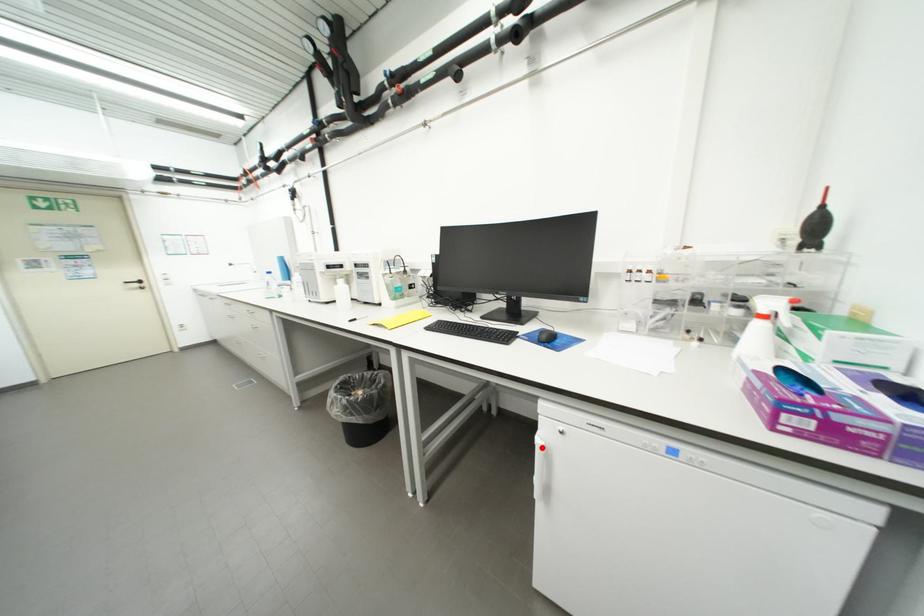
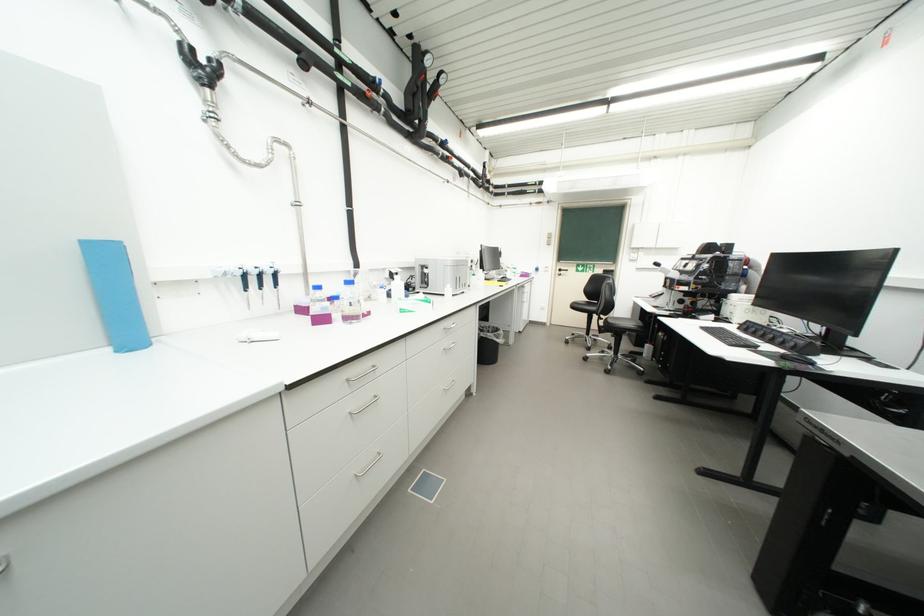
Question: I am providing you with two images of the same scene from different viewpoints. A red point is marked on the first image. At the location where the point appears in image 1, is it still visible in image 2?

Choices:
 (A) Yes
 (B) No

Answer: (B)